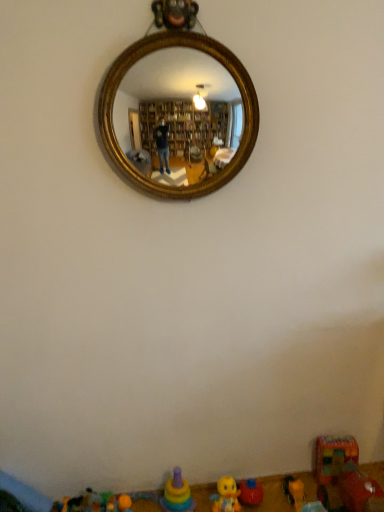
I want to click on free space to the back side of yellow plastic toy at lower right, which is the 6th toy from left to right, so click(293, 479).